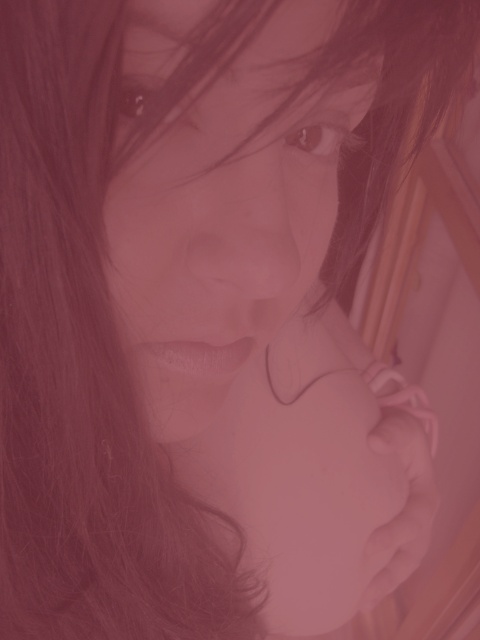
You are an artist sketching this portrait. You need to decide the order to draw elements so that the hand appears to be reaching towards the face. Based on their positions in the image, which should you draw first, the smooth skin face at center or the pink matte hand at center?

The smooth skin face at center is above the pink matte hand at center. To create the illusion that the hand is reaching towards the face, you should draw the pink matte hand at center first, then position the smooth skin face at center above it so that the hand appears to be moving upward toward the face.

You are an artist analyzing this portrait. You notice two points marked on the image. The first point is at coordinates point (194, 355) and the second is at point (384, 406). Based on the depth cues in the image, which point is closer to the viewer?

Point (194, 355) is closer to the viewer than point (384, 406).